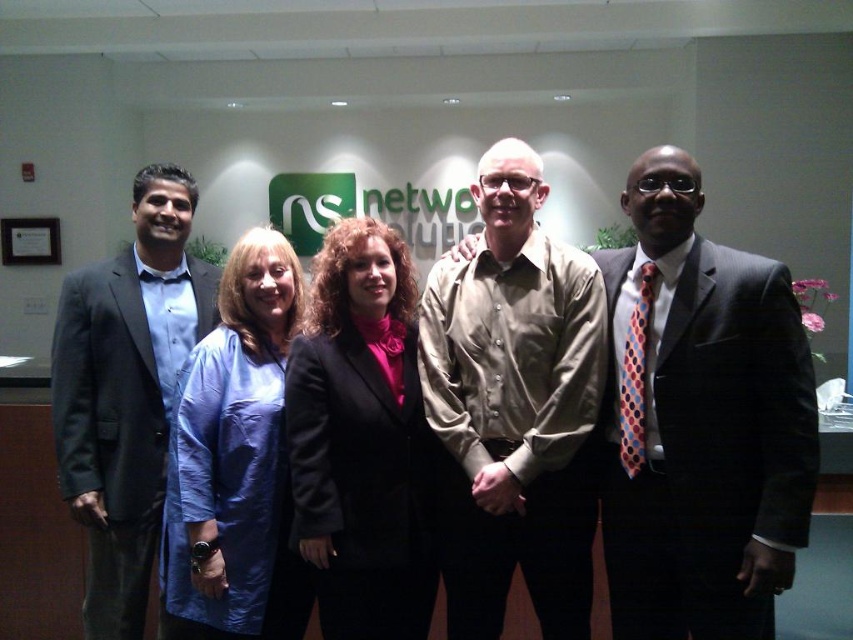
Which is behind, point (639, 273) or point (374, 240)?

Point (374, 240)

Between matte khaki shirt at center and matte black blazer at center, which one has less height?

Standing shorter between the two is matte black blazer at center.

Between point (674, 189) and point (343, 369), which one is positioned behind?

Point (343, 369)

You are a GUI agent. You are given a task and a screenshot of the screen. Output one action in this format:
    pyautogui.click(x=<x>, y=<y>)
    Task: Click on the matte khaki shirt at center
    The image size is (853, 640).
    Given the screenshot: What is the action you would take?
    pyautogui.click(x=700, y=420)

Is tan cotton shirt at center bigger than blue fabric coat at center?

Correct, tan cotton shirt at center is larger in size than blue fabric coat at center.

This screenshot has width=853, height=640. In order to click on tan cotton shirt at center in this screenshot , I will do `click(514, 406)`.

How far apart are matte khaki shirt at center and tan cotton shirt at center?

matte khaki shirt at center and tan cotton shirt at center are 26.70 centimeters apart.

The image size is (853, 640). Describe the element at coordinates (700, 420) in the screenshot. I see `matte khaki shirt at center` at that location.

Where is `matte khaki shirt at center`? matte khaki shirt at center is located at coordinates pos(700,420).